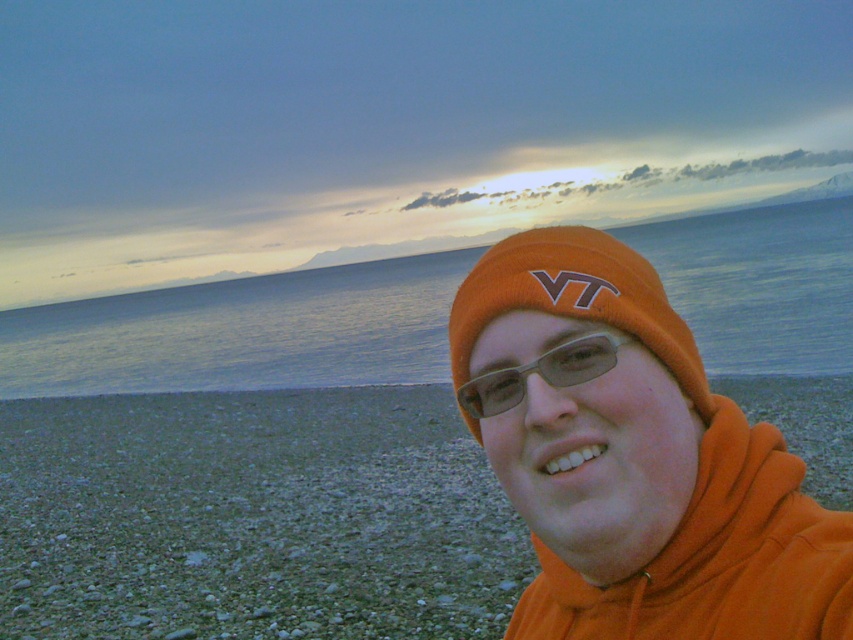
Question: Is blue water at center wider than transparent plastic glasses at center?

Choices:
 (A) yes
 (B) no

Answer: (A)

Question: Which of these objects is positioned farthest from the orange fleece at center?

Choices:
 (A) orange knit beanie at center
 (B) blue water at center
 (C) orange fabric at lower right
 (D) transparent plastic glasses at center

Answer: (B)

Question: Which point is farther from the camera taking this photo?

Choices:
 (A) (683, 323)
 (B) (225, 536)
 (C) (614, 365)

Answer: (B)

Question: Where is orange fleece at center located in relation to transparent plastic glasses at center in the image?

Choices:
 (A) below
 (B) above

Answer: (A)

Question: Which object is the closest to the blue water at center?

Choices:
 (A) orange fabric at lower right
 (B) transparent plastic glasses at center

Answer: (A)

Question: Does orange fleece at center appear under blue water at center?

Choices:
 (A) yes
 (B) no

Answer: (A)